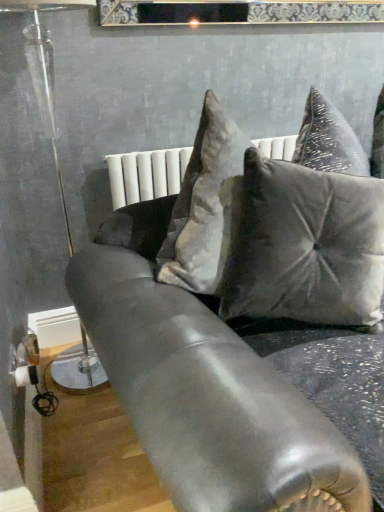
Question: Relative to satin black couch at center, is satin gray pillow at center in front or behind?

Choices:
 (A) front
 (B) behind

Answer: (B)

Question: In terms of height, does satin gray pillow at center look taller or shorter compared to satin black couch at center?

Choices:
 (A) tall
 (B) short

Answer: (B)

Question: Which object is the closest to the clear glass lamp at left?

Choices:
 (A) satin gray pillow at center
 (B) satin black couch at center

Answer: (B)

Question: Which is nearer to the satin gray pillow at center?

Choices:
 (A) satin black couch at center
 (B) clear glass lamp at left

Answer: (A)